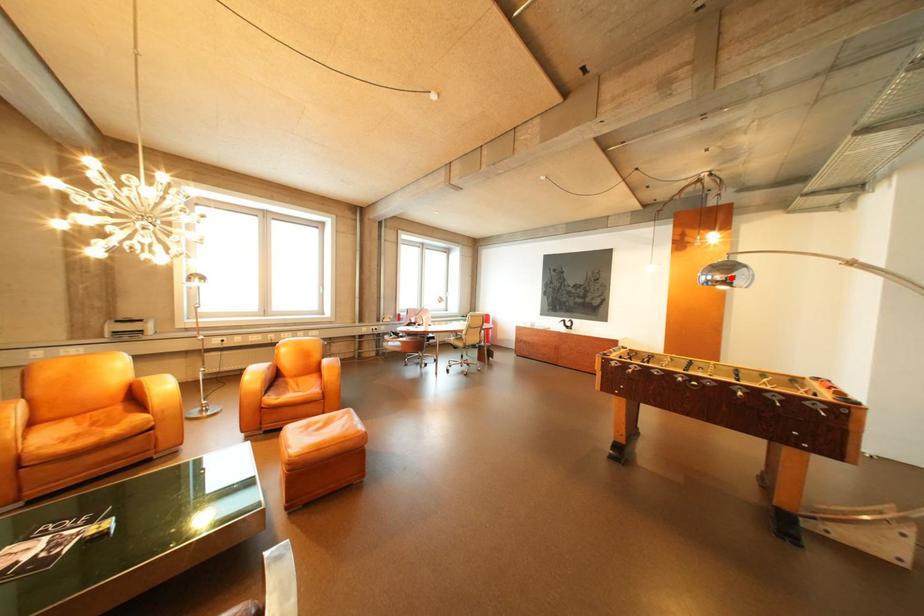
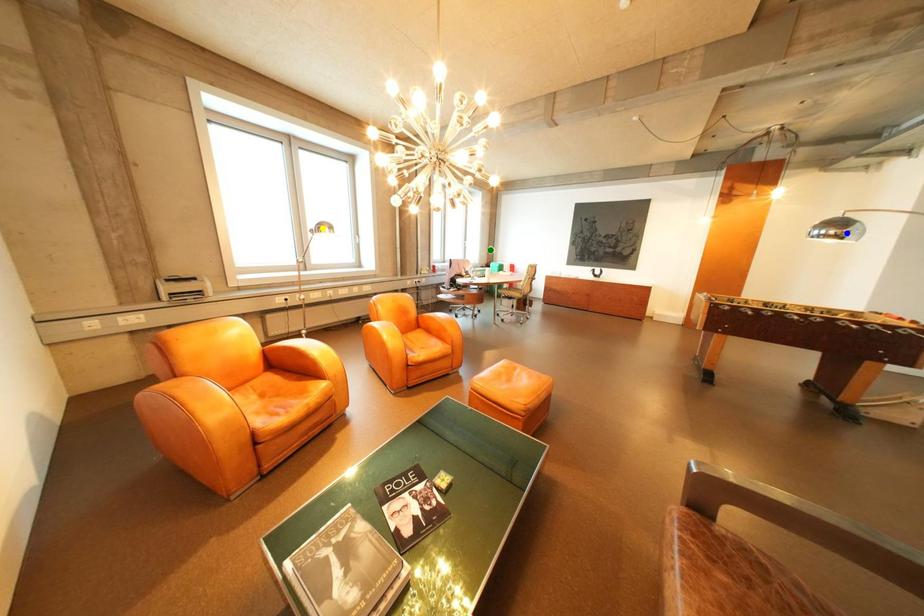
Question: I am providing you with two images of the same scene from different viewpoints. A red point is marked on the first image. You are given multiple points on the second image. In image 2, which mark is for the same physical point as the one in image 1?

Choices:
 (A) yellow point
 (B) green point
 (C) blue point

Answer: (C)